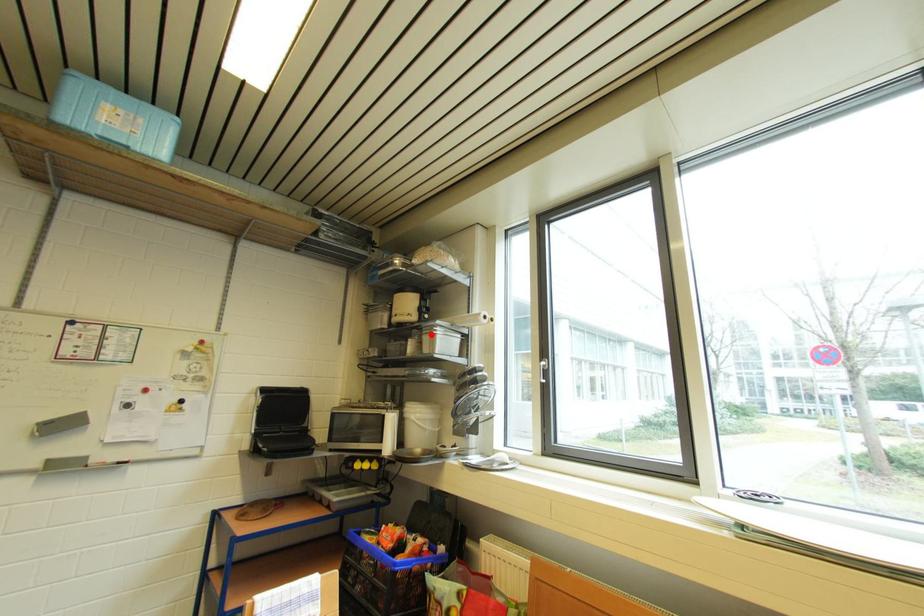
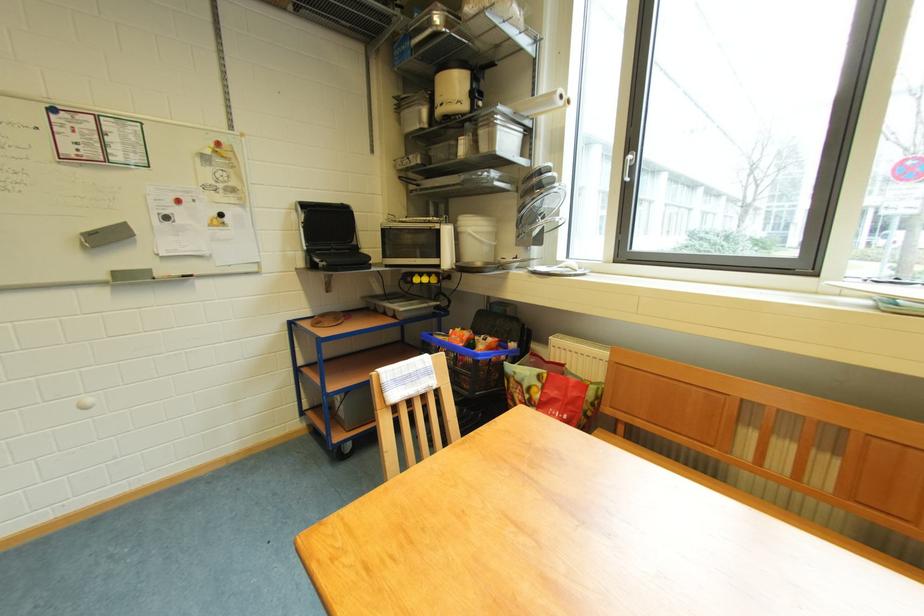
The point at the highlighted location is marked in the first image. Where is the corresponding point in the second image?

(488, 127)